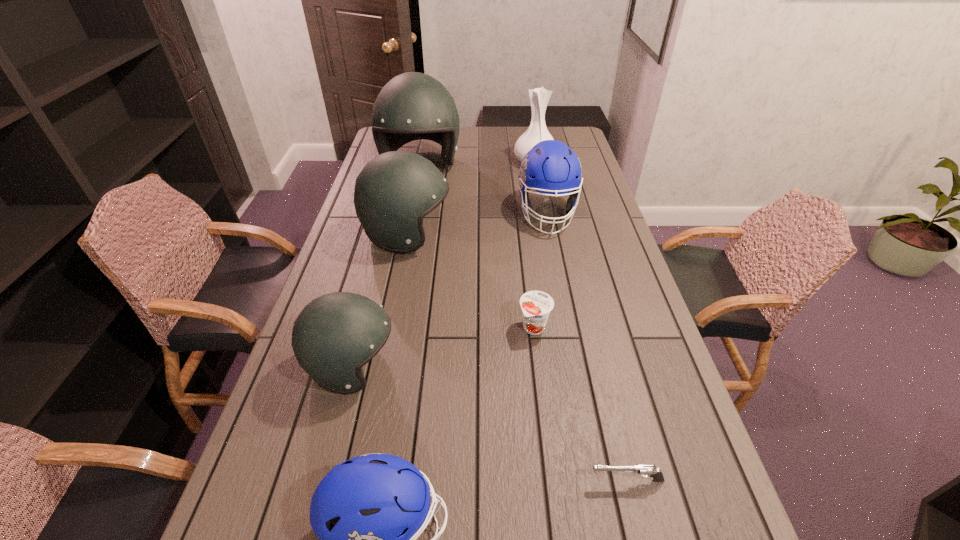
Where is `pistol`? pistol is located at coordinates 645,470.

Locate an element on the screen. vacant space situated at the face opening of the farthest green football helmet is located at coordinates (403, 246).

At what (x,y) coordinates should I click in order to perform the action: click on free space located 0.070m on the front of the vase. Please return your answer as a coordinate pair (x, y). The width and height of the screenshot is (960, 540). Looking at the image, I should click on (538, 181).

Image resolution: width=960 pixels, height=540 pixels. In order to click on free space located at the face opening of the second nearest green football helmet in this screenshot , I will do `click(475, 235)`.

At what (x,y) coordinates should I click in order to perform the action: click on vacant space situated 0.130m on the face guard of the bigger blue football helmet. Please return your answer as a coordinate pair (x, y). The image size is (960, 540). Looking at the image, I should click on (557, 265).

At what (x,y) coordinates should I click in order to perform the action: click on free space located 0.230m at the face opening of the smallest green football helmet. Please return your answer as a coordinate pair (x, y). Looking at the image, I should click on (492, 367).

Locate an element on the screen. vacant region located 0.270m on the back of the yogurt is located at coordinates (525, 253).

The image size is (960, 540). I want to click on free space located on the front-facing side of the silver pistol, so click(x=529, y=480).

The height and width of the screenshot is (540, 960). Find the location of `blank space located 0.270m on the front-facing side of the silver pistol`. blank space located 0.270m on the front-facing side of the silver pistol is located at coordinates (454, 480).

The width and height of the screenshot is (960, 540). I want to click on free space located 0.260m on the front-facing side of the silver pistol, so click(459, 480).